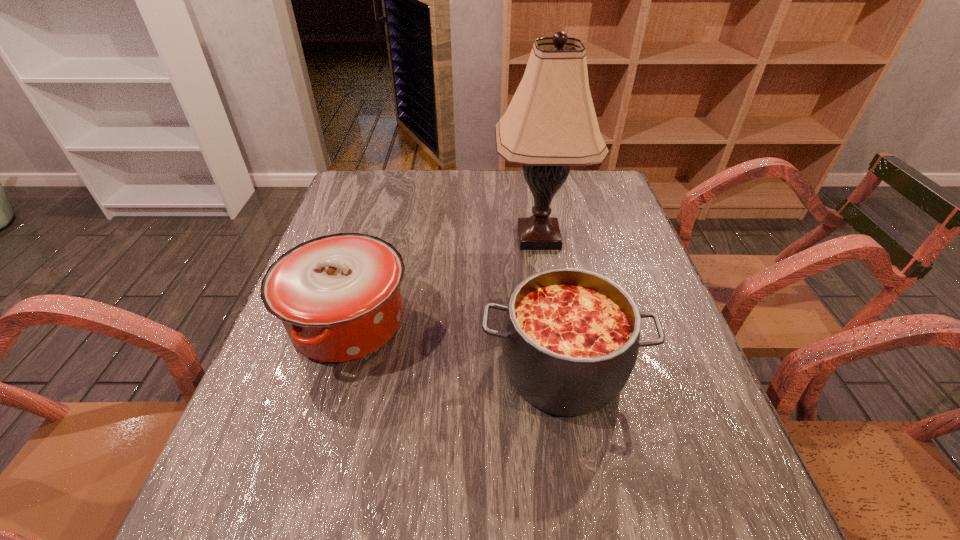
The height and width of the screenshot is (540, 960). What are the coordinates of `the tallest object` in the screenshot? It's located at (550, 124).

Locate an element on the screen. lamp is located at coordinates (550, 124).

Find the location of `the left casserole`. the left casserole is located at coordinates (338, 296).

Where is `the right casserole`? the right casserole is located at coordinates (570, 338).

Find the location of `vacant region located 0.100m on the right of the tallest object`. vacant region located 0.100m on the right of the tallest object is located at coordinates (620, 238).

What are the coordinates of `vacant space located 0.160m on the back of the left casserole` in the screenshot? It's located at (373, 237).

The image size is (960, 540). In order to click on free space located on the back of the right casserole in this screenshot , I will do `click(550, 294)`.

This screenshot has height=540, width=960. I want to click on object that is at the left edge, so click(x=338, y=296).

At what (x,y) coordinates should I click in order to perform the action: click on lamp present at the right edge. Please return your answer as a coordinate pair (x, y). Looking at the image, I should click on (550, 124).

This screenshot has height=540, width=960. I want to click on casserole located at the right edge, so click(x=570, y=338).